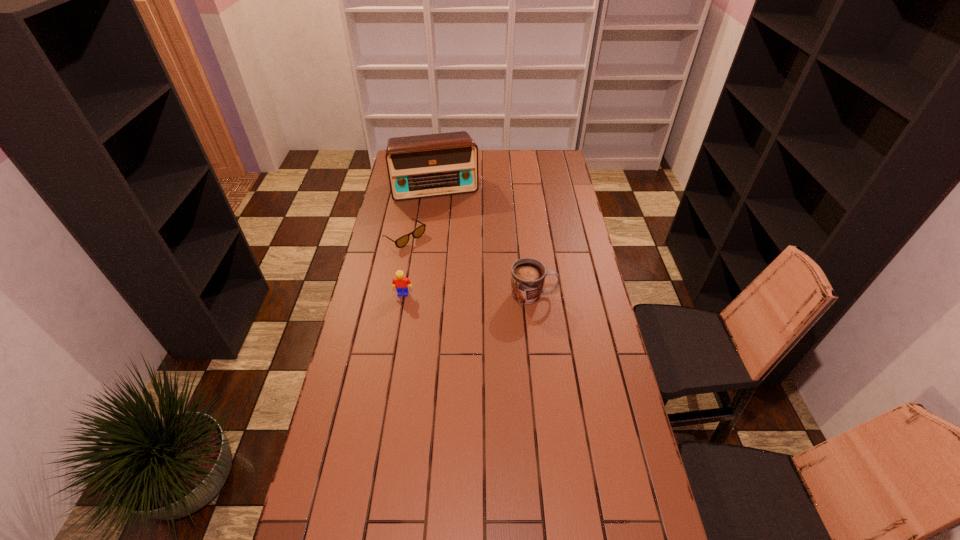
In order to click on free spot on the desktop that is between the Lego and the mug and is positioned on the front-facing side of the sunglasses in this screenshot , I will do `click(486, 295)`.

At what (x,y) coordinates should I click in order to perform the action: click on vacant spot on the desktop that is between the Lego and the mug and is positioned on the front-facing side of the farthest object. Please return your answer as a coordinate pair (x, y). The height and width of the screenshot is (540, 960). Looking at the image, I should click on (459, 294).